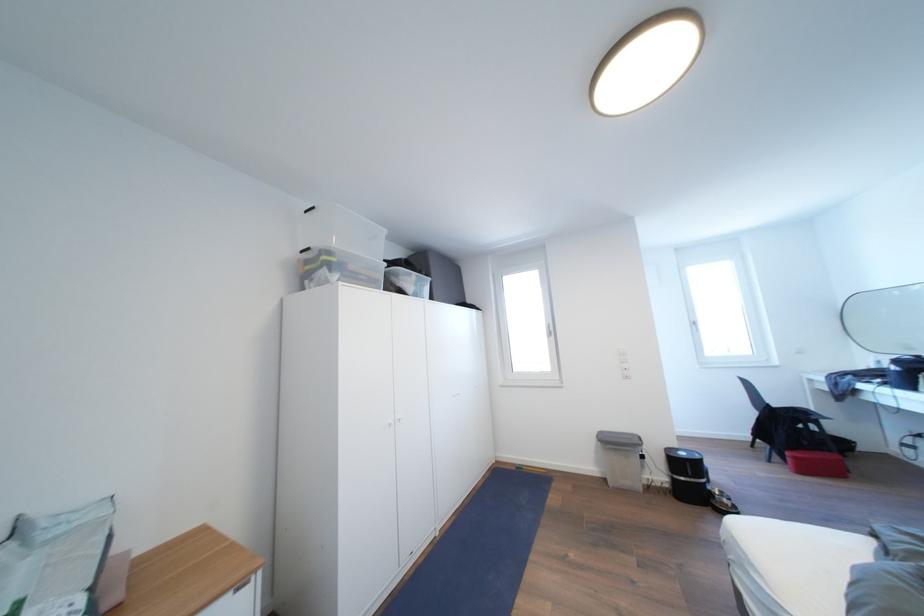
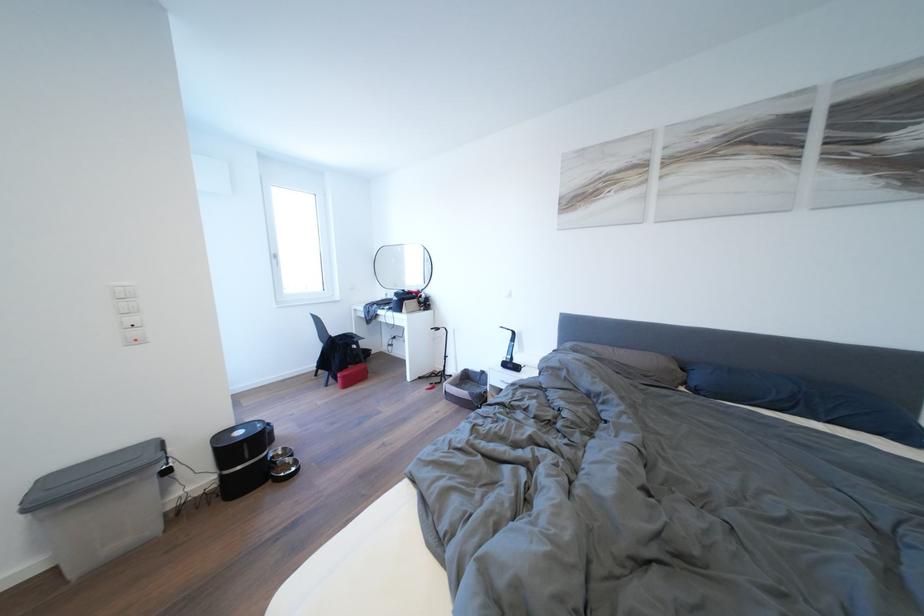
Question: The first image is from the beginning of the video and the second image is from the end. How did the camera likely rotate when shooting the video?

Choices:
 (A) Left
 (B) Right
 (C) Up
 (D) Down

Answer: (B)